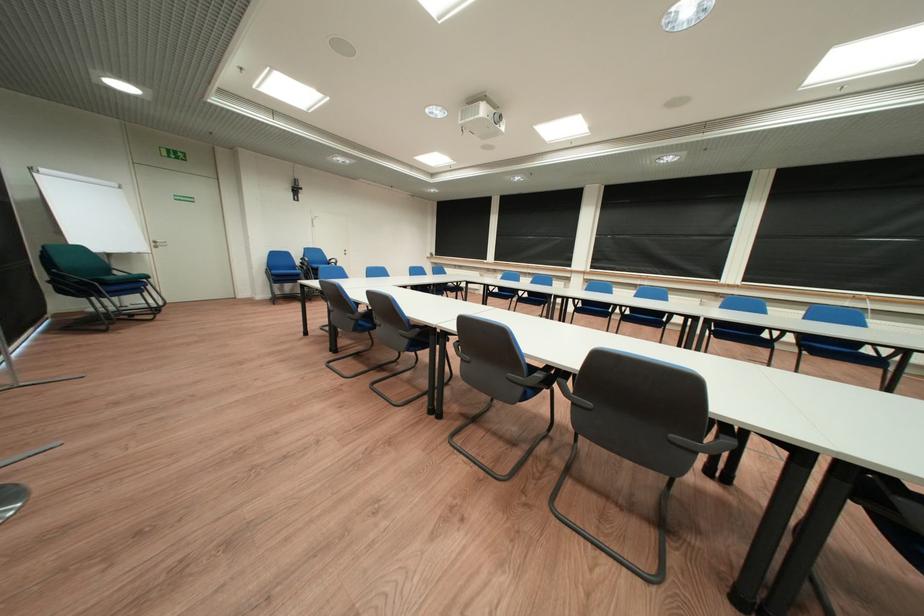
I want to click on silver door handle, so click(159, 244).